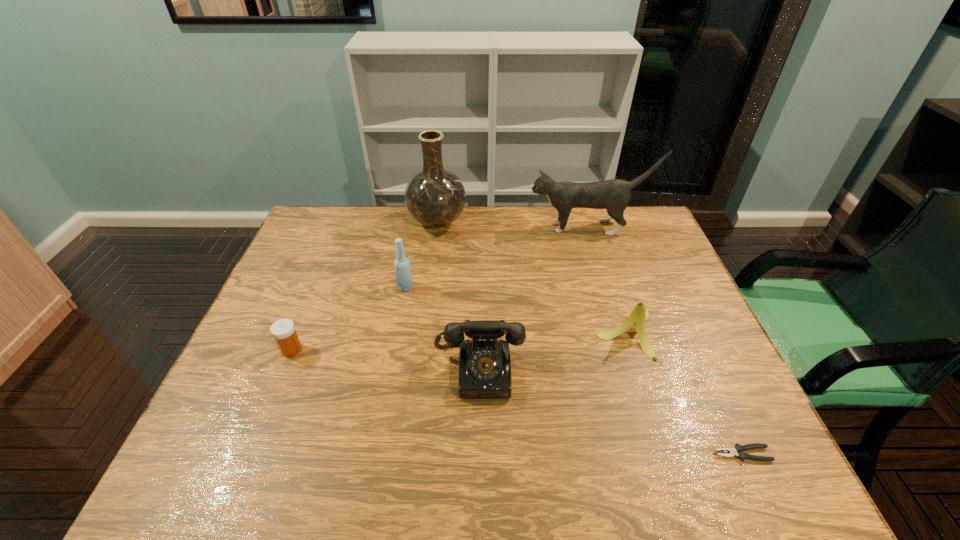
Locate an element on the screen. vase is located at coordinates tap(434, 197).

Where is `cat`? The height and width of the screenshot is (540, 960). cat is located at coordinates (614, 195).

This screenshot has width=960, height=540. Identify the location of the third farthest object. (403, 273).

Where is `the third tallest object`? the third tallest object is located at coordinates (403, 273).

Where is `banana`? Image resolution: width=960 pixels, height=540 pixels. banana is located at coordinates (638, 316).

Identify the location of telephone. The height and width of the screenshot is (540, 960). (484, 360).

Where is `the second shortest object`? the second shortest object is located at coordinates (283, 330).

Identify the location of medicine. The height and width of the screenshot is (540, 960). (283, 330).

Locate an element on the screen. pliers is located at coordinates (736, 451).

The height and width of the screenshot is (540, 960). I want to click on the shortest object, so click(x=736, y=451).